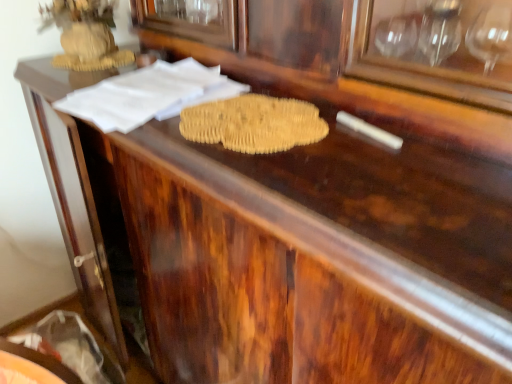
Image resolution: width=512 pixels, height=384 pixels. I want to click on baked golden bread at center, so click(x=254, y=124).

Describe the element at coordinates (254, 124) in the screenshot. I see `baked golden bread at center` at that location.

In order to click on baked golden bread at center in this screenshot , I will do `click(254, 124)`.